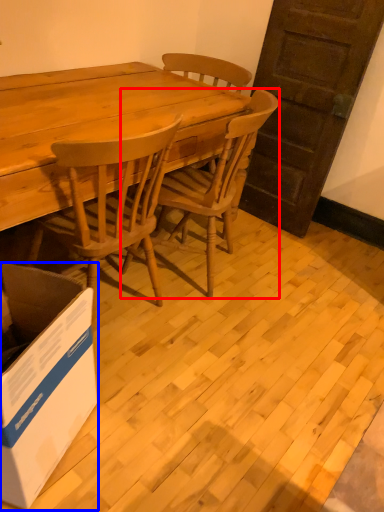
Question: Which point is closer to the camera, chair (highlighted by a red box) or box (highlighted by a blue box)?

Choices:
 (A) chair
 (B) box

Answer: (B)